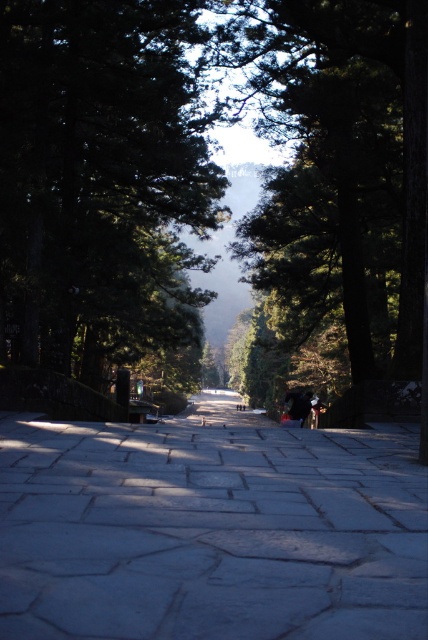
Question: Where is green textured tree at center located in relation to green matte tree at center in the image?

Choices:
 (A) below
 (B) above

Answer: (B)

Question: Which point is closer to the camera taking this photo?

Choices:
 (A) (0, 164)
 (B) (366, 4)

Answer: (A)

Question: Is green textured tree at center thinner than green matte tree at center?

Choices:
 (A) no
 (B) yes

Answer: (A)

Question: Where is gray stone pavement at center located in relation to green matte tree at center in the image?

Choices:
 (A) below
 (B) above

Answer: (A)

Question: Among these points, which one is farthest from the camera?

Choices:
 (A) (30, 99)
 (B) (8, 625)
 (C) (359, 273)

Answer: (C)

Question: Which object appears closest to the camera in this image?

Choices:
 (A) green matte tree at center
 (B) green textured tree at center

Answer: (A)